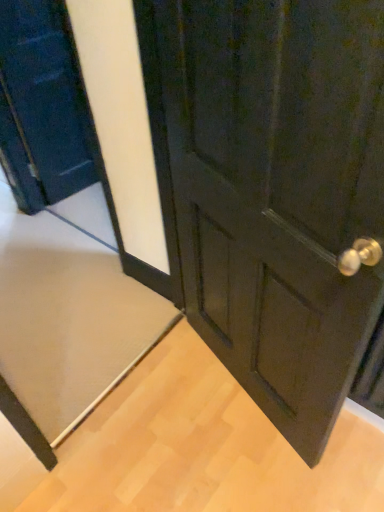
Locate an element on the screen. The height and width of the screenshot is (512, 384). free space above beige carpet at lower left (from a real-world perspective) is located at coordinates (44, 281).